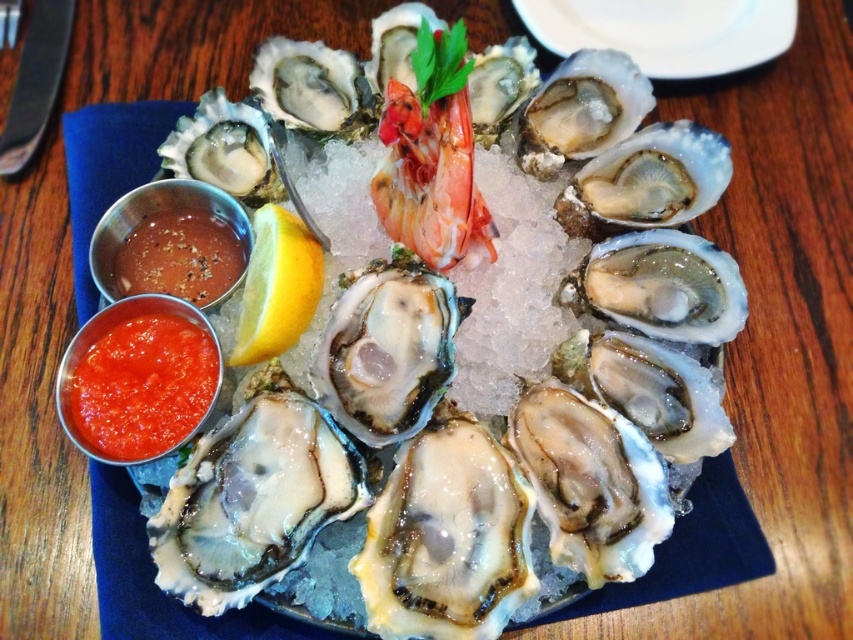
You are a food stylist arranging a plate of oysters. You need to place the white shell oyster at center and the yellow matte lemon at center according to the image. Which object should be placed to the left of the other?

The yellow matte lemon at center should be placed to the left of the white shell oyster at center because the white shell oyster at center is to the right of the yellow matte lemon at center.

You are standing in a kitchen and see a point on the counter at position (x=109, y=352). If you want to place a small bowl of spices there, will it be within reach of your hand that can extend 4 feet? Please explain.

The point at (x=109, y=352) is 3.92 feet away from the viewer, which is within the 4 feet reach of your hand. Therefore, you can place the small bowl of spices there and reach it.

You are a food critic evaluating the presentation of this dish. The white shell oyster at center and the smokey brown paste at lower left are key elements. Based on their positions, which one is located to the right side of the other?

The white shell oyster at center is to the right of smokey brown paste at lower left, so the white shell oyster at center is located to the right of the smokey brown paste at lower left.